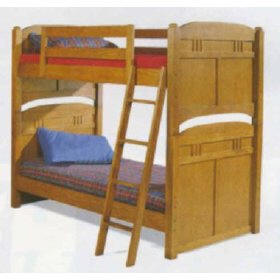
Image resolution: width=280 pixels, height=280 pixels. What are the coordinates of `multi colored pillow` in the screenshot? It's located at (69, 40).